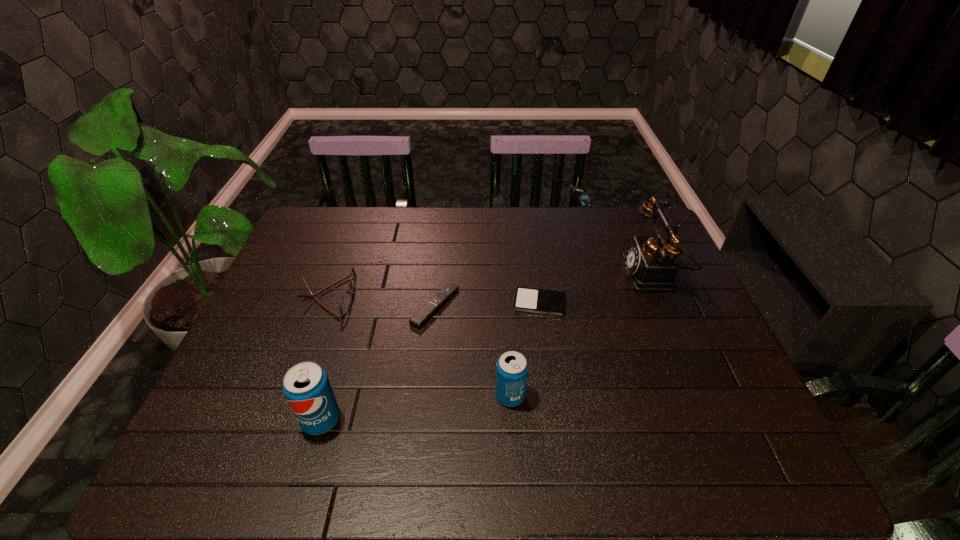
The width and height of the screenshot is (960, 540). What are the coordinates of `vacant space that satisfies the following two spatial constraints: 1. on the front-facing side of the spectacles; 2. on the left side of the iPod` in the screenshot? It's located at (326, 303).

Where is `free space that satisfies the following two spatial constraints: 1. on the back side of the left soda can; 2. on the front-facing side of the spectacles`? The height and width of the screenshot is (540, 960). free space that satisfies the following two spatial constraints: 1. on the back side of the left soda can; 2. on the front-facing side of the spectacles is located at coordinates (357, 296).

This screenshot has width=960, height=540. I want to click on blank space that satisfies the following two spatial constraints: 1. on the back side of the iPod; 2. on the right side of the fifth tallest object, so click(x=436, y=303).

Image resolution: width=960 pixels, height=540 pixels. I want to click on free space that satisfies the following two spatial constraints: 1. on the front-facing side of the shorter soda can; 2. on the right side of the third shortest object, so click(293, 396).

At what (x,y) coordinates should I click in order to perform the action: click on vacant point that satisfies the following two spatial constraints: 1. on the front-facing side of the fifth tallest object; 2. on the left side of the spectacles. Please return your answer as a coordinate pair (x, y). This screenshot has width=960, height=540. Looking at the image, I should click on [x=325, y=306].

Image resolution: width=960 pixels, height=540 pixels. Find the location of `free point that satisfies the following two spatial constraints: 1. on the front-facing side of the third shortest object; 2. on the right side of the second shortest object`. free point that satisfies the following two spatial constraints: 1. on the front-facing side of the third shortest object; 2. on the right side of the second shortest object is located at coordinates (325, 306).